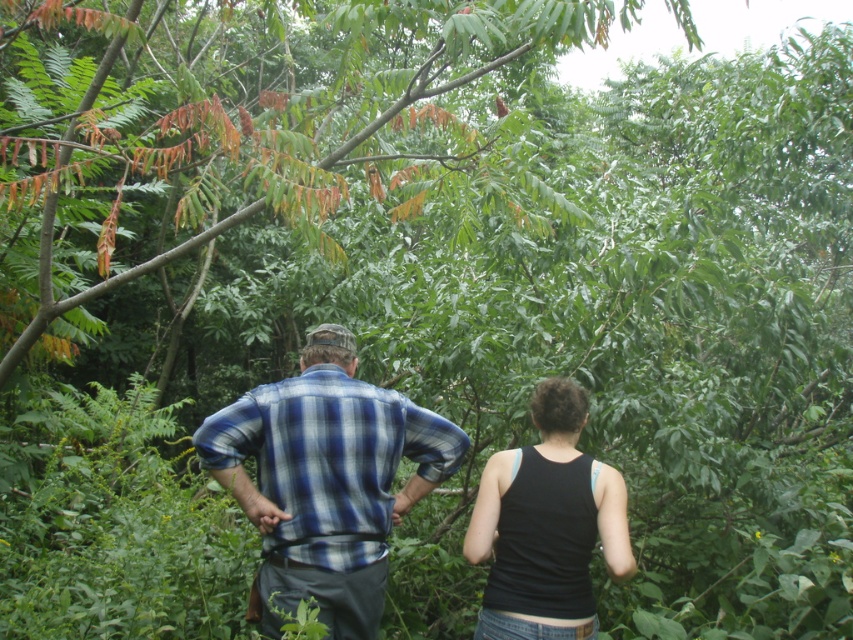
Question: Observing the image, what is the correct spatial positioning of blue plaid shirt at center in reference to black fabric tank top at center?

Choices:
 (A) below
 (B) above

Answer: (B)

Question: Is blue plaid shirt at center positioned at the back of black fabric tank top at center?

Choices:
 (A) no
 (B) yes

Answer: (B)

Question: Does blue plaid shirt at center appear on the left side of black fabric tank top at center?

Choices:
 (A) yes
 (B) no

Answer: (A)

Question: Which point is closer to the camera?

Choices:
 (A) (352, 390)
 (B) (531, 483)

Answer: (B)